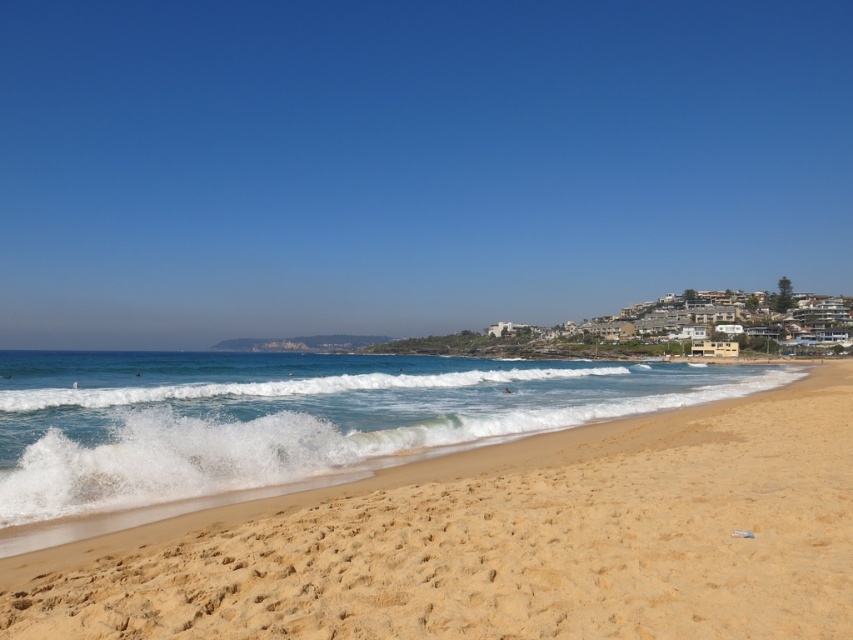
Question: Which of the following is the closest to the observer?

Choices:
 (A) sandy yellow at beach right
 (B) white foamy wave at center

Answer: (A)

Question: Does sandy yellow at beach right appear over white foamy wave at center?

Choices:
 (A) no
 (B) yes

Answer: (B)

Question: Which of the following is the farthest from the observer?

Choices:
 (A) sandy yellow at beach right
 (B) white foamy wave at center

Answer: (B)

Question: Is sandy yellow at beach right behind white foamy wave at center?

Choices:
 (A) no
 (B) yes

Answer: (A)

Question: From the image, what is the correct spatial relationship of sandy yellow at beach right in relation to white foamy wave at center?

Choices:
 (A) left
 (B) right

Answer: (B)

Question: Among these points, which one is nearest to the camera?

Choices:
 (A) (276, 518)
 (B) (558, 376)

Answer: (A)